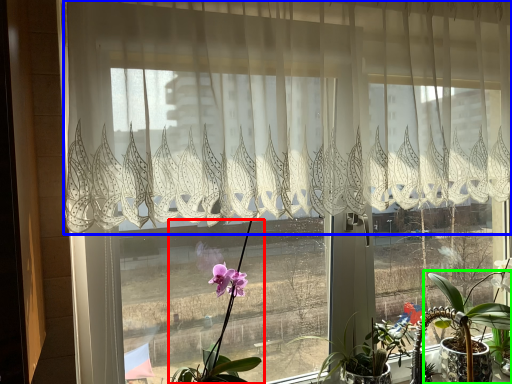
Question: Considering the real-world distances, which object is farthest from houseplant (highlighted by a red box)? curtain (highlighted by a blue box) or houseplant (highlighted by a green box)?

Choices:
 (A) curtain
 (B) houseplant

Answer: (B)